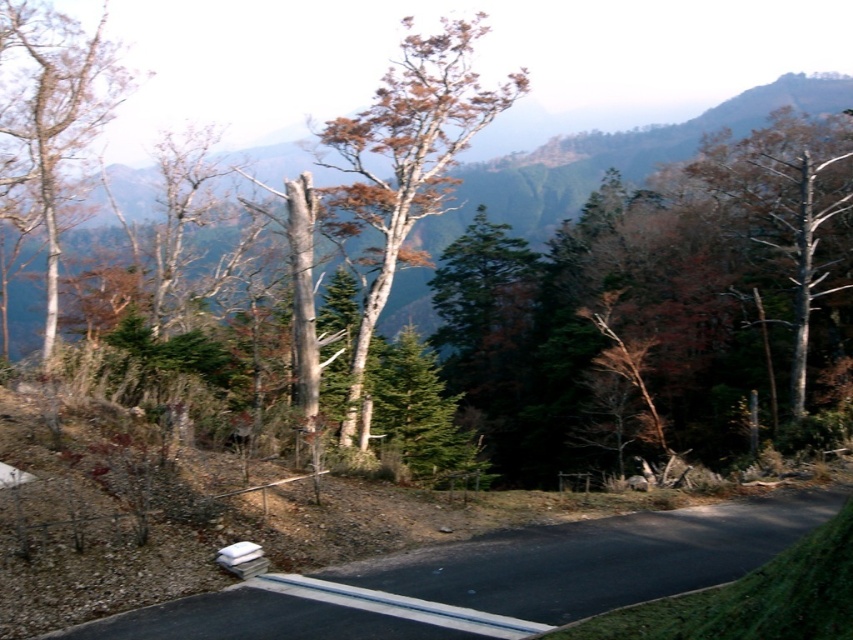
Is point (387, 196) behind point (15, 132)?

Yes, it is.

Measure the distance between brown bark tree at center and camera.

brown bark tree at center and camera are 24.46 meters apart.

The height and width of the screenshot is (640, 853). In order to click on brown bark tree at center in this screenshot , I will do `click(405, 163)`.

Is black asphalt road at lower center wider than brown bark tree at center?

In fact, black asphalt road at lower center might be narrower than brown bark tree at center.

Does point (573, 611) come closer to viewer compared to point (407, 28)?

Yes, it is in front of point (407, 28).

Locate an element on the screen. Image resolution: width=853 pixels, height=640 pixels. black asphalt road at lower center is located at coordinates (596, 557).

Is point (793, 506) closer to viewer compared to point (102, 22)?

Yes.

Who is positioned more to the left, black asphalt road at lower center or smooth white tree at left?

smooth white tree at left is more to the left.

Locate an element on the screen. black asphalt road at lower center is located at coordinates (596, 557).

I want to click on black asphalt road at lower center, so (x=596, y=557).